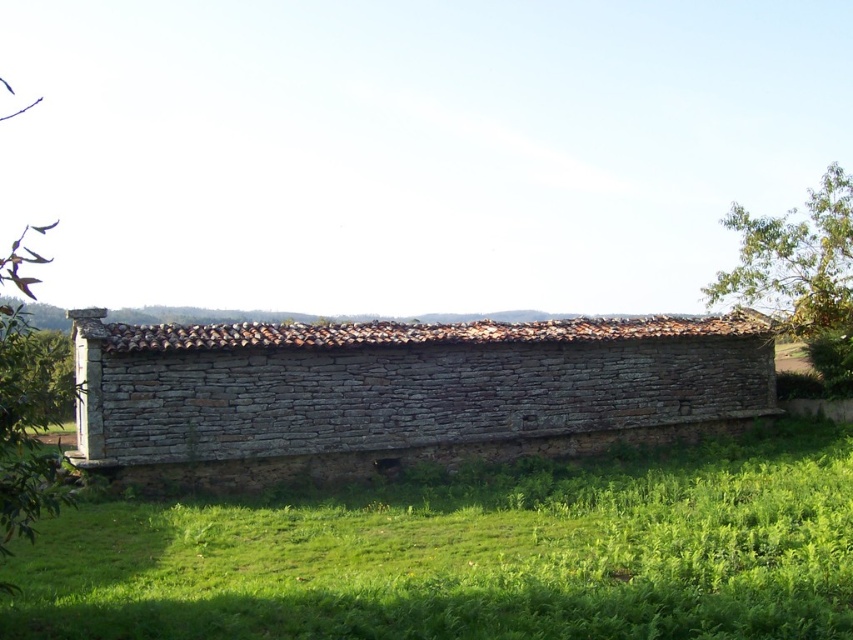
You are a gardener who wants to mow the green grass at lower center. Considering the height of the gray stone hut at center, will the grass be shorter than the hut after mowing?

The green grass at lower center currently has a lesser height compared to the gray stone hut at center. After mowing, the grass will be even shorter, so yes, it will remain shorter than the hut.

You are standing at the entrance of the rustic stone structure and looking towards the green leafy tree at upper right. Which direction should you walk to reach the green grass at lower center?

The green grass at lower center is located below the green leafy tree at upper right, so you should walk downward or towards the lower part of the scene to reach the green grass at lower center.

You are standing at the center of the image. Which direction should you walk to reach the green grass at lower center?

You should walk downward because the green grass at lower center is located below your current position at the center of the image.